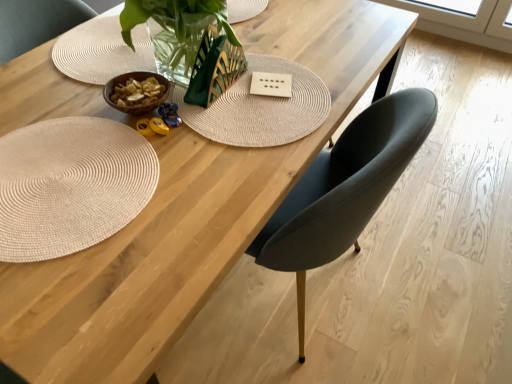
Where is `free location above natural woven mat at lower left (from a real-world perspective)`? This screenshot has width=512, height=384. free location above natural woven mat at lower left (from a real-world perspective) is located at coordinates (67, 178).